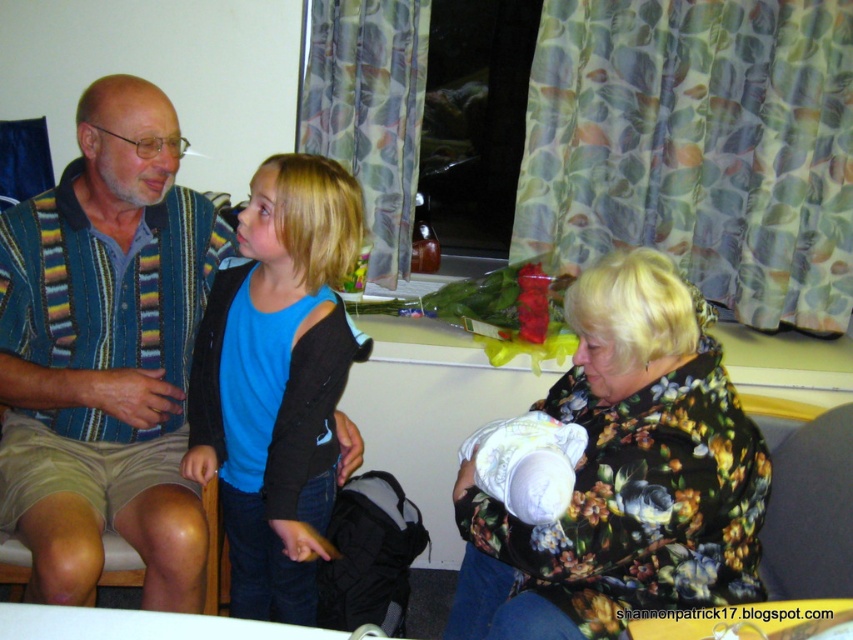
Who is positioned more to the right, striped fabric shirt at left or blue cotton shirt at center?

blue cotton shirt at center

Who is more distant from viewer, (32, 365) or (271, 508)?

Positioned behind is point (32, 365).

Where is `striped fabric shirt at left`? The height and width of the screenshot is (640, 853). striped fabric shirt at left is located at coordinates (105, 353).

Can you confirm if striped fabric shirt at left is shorter than floral print sweater at center?

In fact, striped fabric shirt at left may be taller than floral print sweater at center.

Does striped fabric shirt at left have a smaller size compared to floral print sweater at center?

Correct, striped fabric shirt at left occupies less space than floral print sweater at center.

Is point (144, 340) farther from camera compared to point (706, 515)?

Yes, point (144, 340) is farther from viewer.

The width and height of the screenshot is (853, 640). I want to click on striped fabric shirt at left, so click(105, 353).

Is point (498, 593) closer to viewer compared to point (323, 340)?

No.

Who is taller, floral print sweater at center or blue cotton shirt at center?

Standing taller between the two is blue cotton shirt at center.

Between point (566, 416) and point (288, 436), which one is positioned behind?

The point (566, 416) is more distant.

Where is `floral print sweater at center`? This screenshot has width=853, height=640. floral print sweater at center is located at coordinates (625, 476).